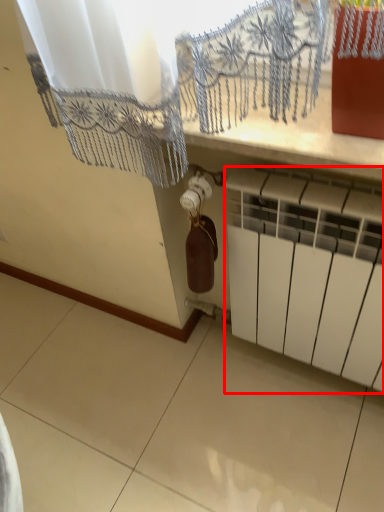
Question: Where is radiator (annotated by the red box) located in relation to wine bottle in the image?

Choices:
 (A) right
 (B) left

Answer: (A)